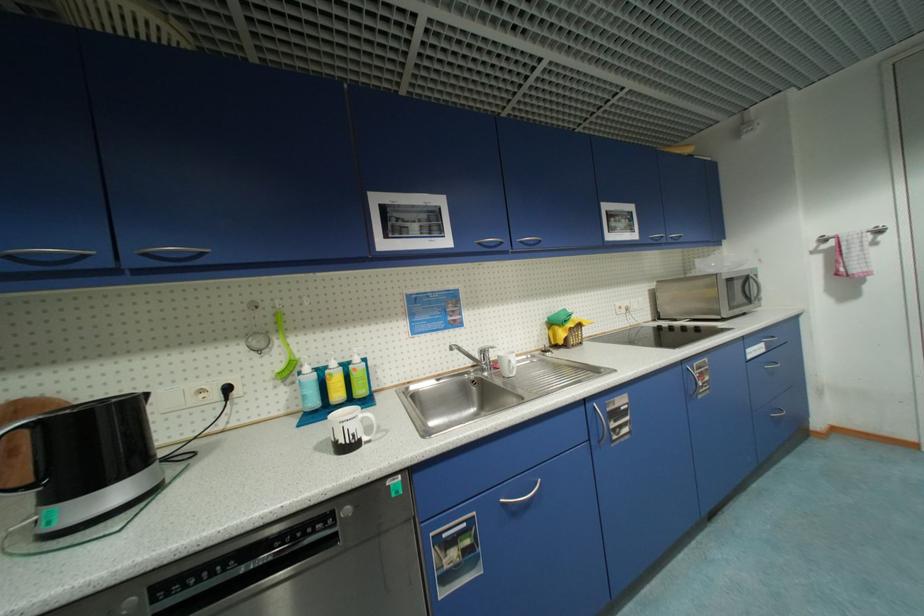
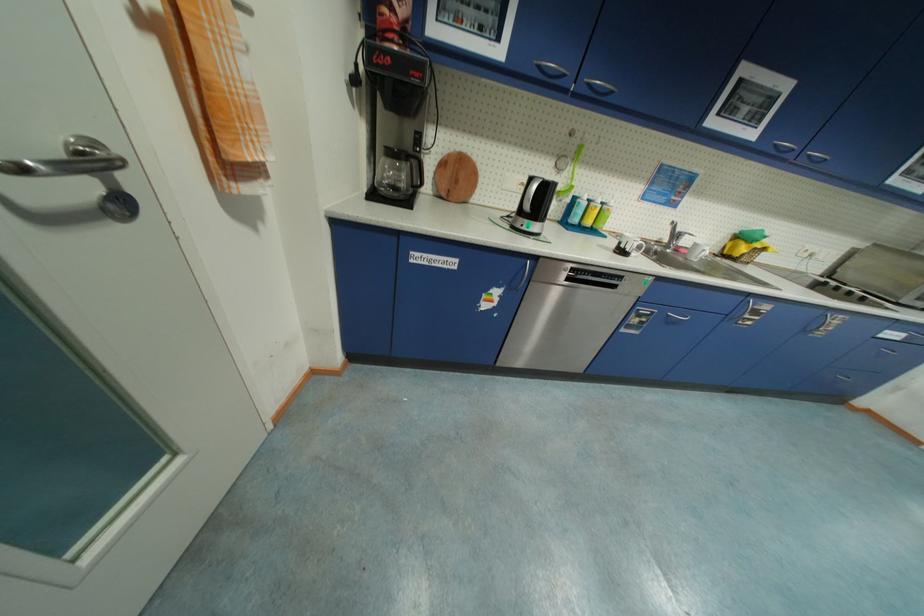
Find the pixel in the second image that matches pixel 523 248 in the first image.

(807, 161)